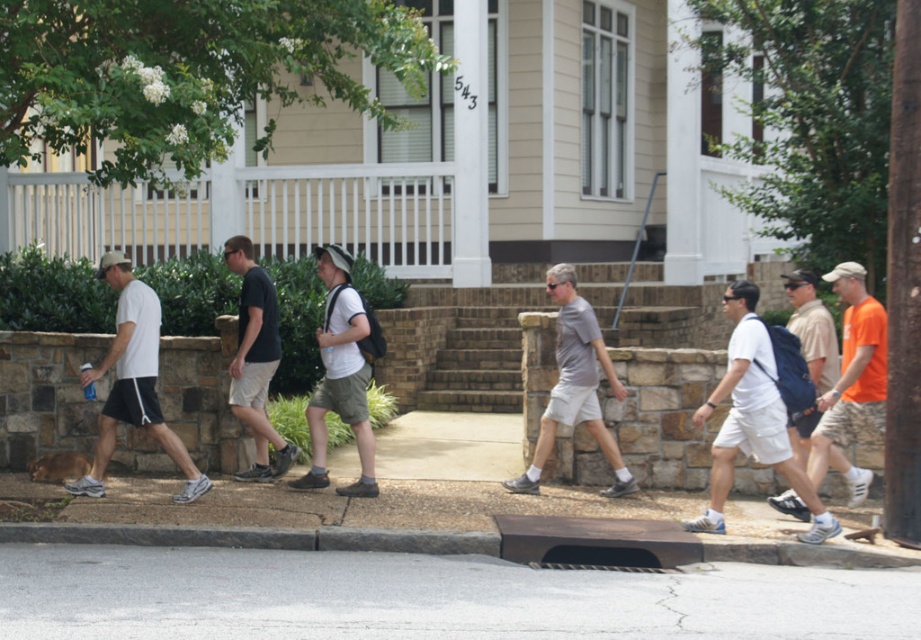
Who is lower down, brown stone stairs at center or white cotton t-shirt at center?

Positioned lower is white cotton t-shirt at center.

Looking at this image, does brown stone stairs at center have a smaller size compared to white cotton t-shirt at center?

Actually, brown stone stairs at center might be larger than white cotton t-shirt at center.

The image size is (921, 640). What do you see at coordinates (461, 342) in the screenshot?
I see `brown stone stairs at center` at bounding box center [461, 342].

What are the coordinates of `brown stone stairs at center` in the screenshot? It's located at (461, 342).

Image resolution: width=921 pixels, height=640 pixels. What do you see at coordinates (340, 376) in the screenshot?
I see `white matte t-shirt at center` at bounding box center [340, 376].

Measure the distance between white matte t-shirt at center and camera.

The distance of white matte t-shirt at center from camera is 11.33 meters.

Does point (354, 406) come farther from viewer compared to point (589, 340)?

No, it is not.

The width and height of the screenshot is (921, 640). In order to click on white matte t-shirt at center in this screenshot , I will do `click(340, 376)`.

Does white matte t-shirt at center appear on the left side of black cotton shirt at center?

No, white matte t-shirt at center is not to the left of black cotton shirt at center.

Between white matte t-shirt at center and black cotton shirt at center, which one appears on the left side from the viewer's perspective?

From the viewer's perspective, black cotton shirt at center appears more on the left side.

The height and width of the screenshot is (640, 921). What do you see at coordinates (340, 376) in the screenshot?
I see `white matte t-shirt at center` at bounding box center [340, 376].

Locate an element on the screen. The width and height of the screenshot is (921, 640). white matte t-shirt at center is located at coordinates (340, 376).